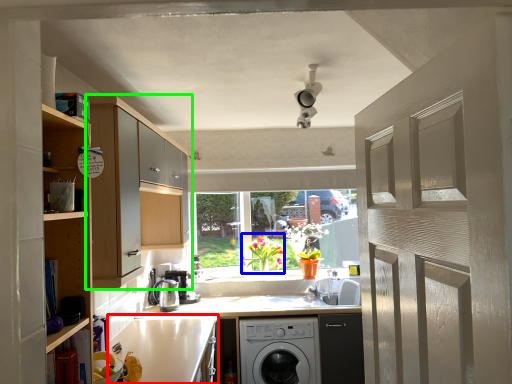
Question: Which object is the farthest from counter top (highlighted by a red box)? Choose among these: plant (highlighted by a blue box) or cabinetry (highlighted by a green box).

Choices:
 (A) plant
 (B) cabinetry

Answer: (A)